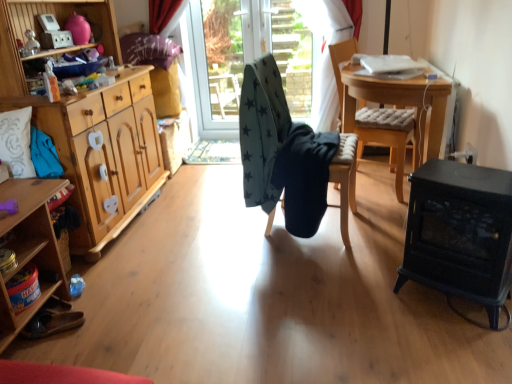
The width and height of the screenshot is (512, 384). Find the location of `free spot to the left of teal star-patterned fabric at center, placed as the third chair when sorted from right to left`. free spot to the left of teal star-patterned fabric at center, placed as the third chair when sorted from right to left is located at coordinates (220, 230).